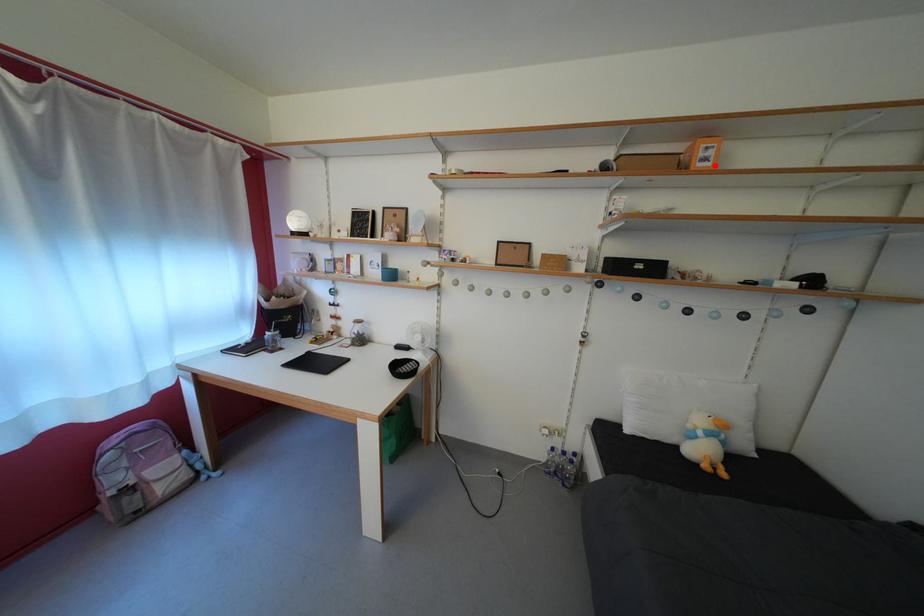
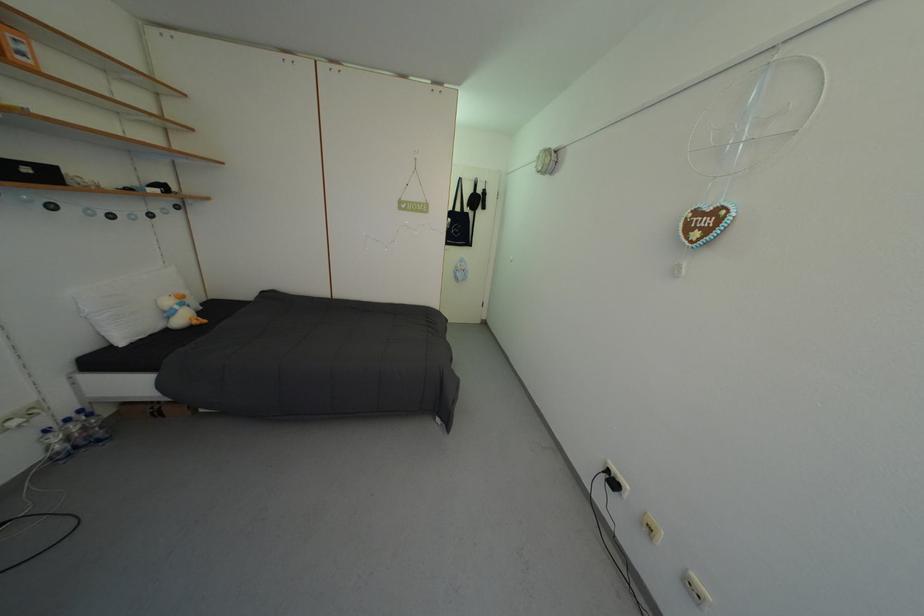
Where in the second image is the point corresponding to the highlighted location from the first image?

(30, 60)